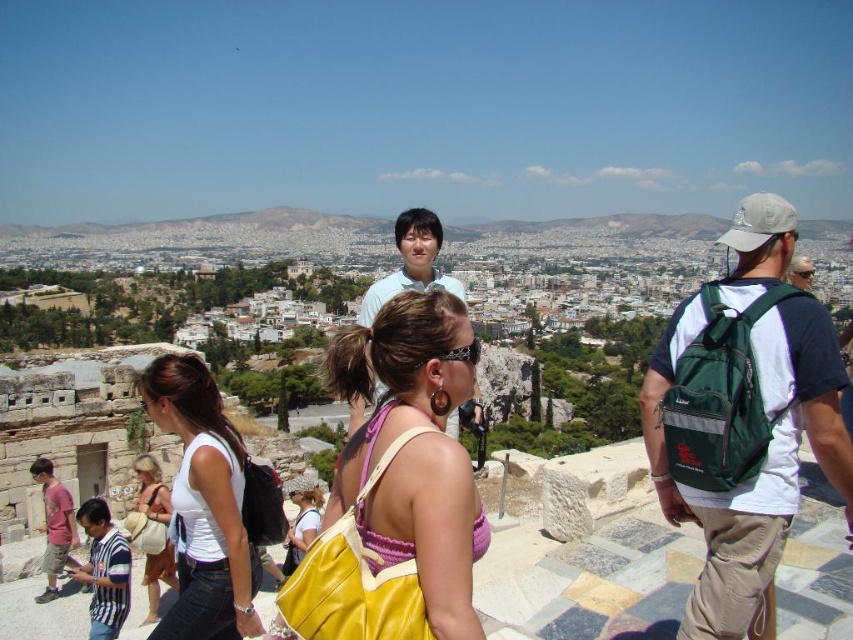
You are a tour guide leading a group at the archaeological site. You notice two points marked in the image. The first point is at coordinate point(416, 513) and the second point is at point(190, 461). From your current position, which point is closer to you?

Point(416, 513) is in front of point(190, 461), so the first point is closer to you.

Based on the photo, you are a photographer trying to capture a clear shot of the yellow fabric purse at center and the white matte tank top at center. Which object should you focus on first if you want to ensure both are in focus without adjusting the camera settings?

The yellow fabric purse at center is taller than the white matte tank top at center, so focusing on the larger object first would help maintain focus on both.

You are a tour guide leading a group at the archaeological site. You notice two tourists, one wearing a light blue shirt at center and another carrying a green fabric backpack at right. Which tourist is positioned lower in the image?

The green fabric backpack at right is located below the light blue shirt at center, so the tourist with the green fabric backpack at right is positioned lower in the image.